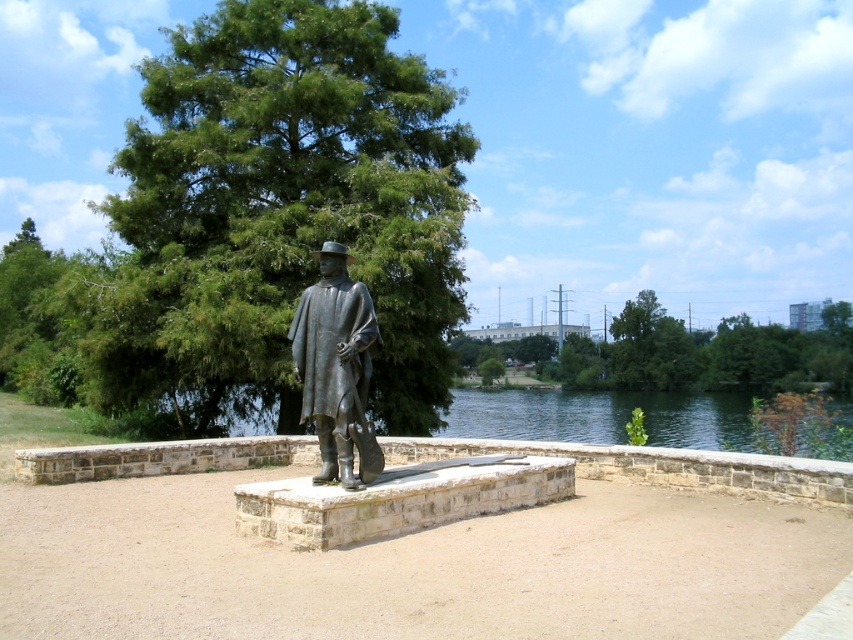
Question: Which of the following is the closest to the observer?

Choices:
 (A) green leafy tree at upper center
 (B) bronze statue at center
 (C) green leafy tree at center

Answer: (B)

Question: Does green leafy tree at upper center have a lesser width compared to bronze statue at center?

Choices:
 (A) yes
 (B) no

Answer: (B)

Question: Does green leafy tree at center lie in front of green leafy tree at upper center?

Choices:
 (A) yes
 (B) no

Answer: (A)

Question: Considering the relative positions of green leafy tree at center and bronze statue at center in the image provided, where is green leafy tree at center located with respect to bronze statue at center?

Choices:
 (A) left
 (B) right

Answer: (A)

Question: Which is farther from the bronze statue at center?

Choices:
 (A) green leafy tree at upper center
 (B) green leafy tree at center

Answer: (A)

Question: Which point is closer to the camera taking this photo?

Choices:
 (A) (641, 372)
 (B) (309, 404)
 (C) (410, 273)

Answer: (B)